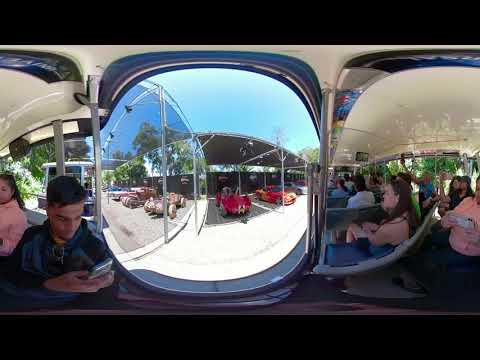
Where is `canopy`? This screenshot has width=480, height=360. canopy is located at coordinates (141, 135), (244, 151).